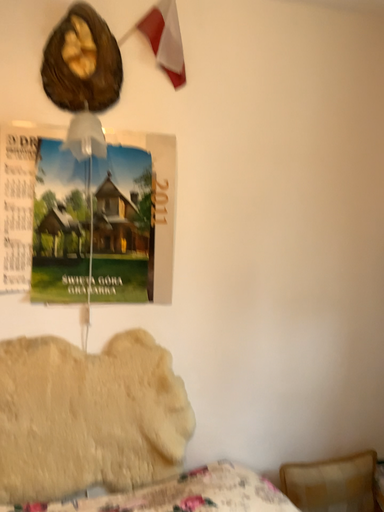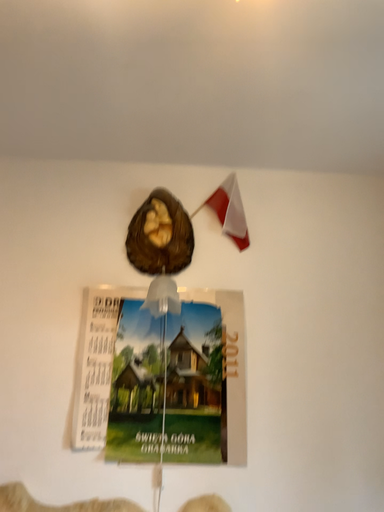
Question: Which way did the camera rotate in the video?

Choices:
 (A) rotated left
 (B) rotated right

Answer: (A)